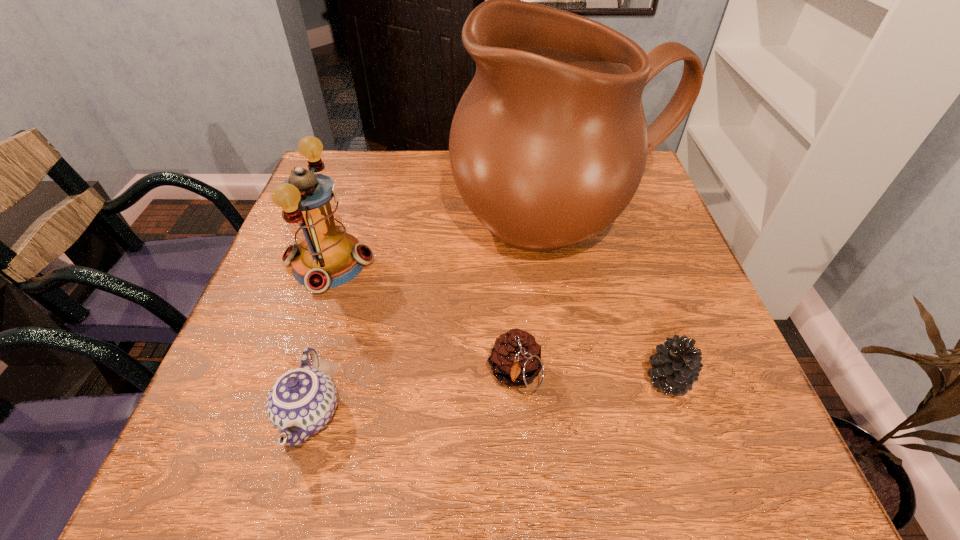
Identify the location of vacant region between the second tallest object and the right pinecone. (499, 321).

Where is `free area in between the fourth shortest object and the right pinecone`? free area in between the fourth shortest object and the right pinecone is located at coordinates (499, 321).

The height and width of the screenshot is (540, 960). I want to click on free spot between the cream pitcher and the right pinecone, so click(x=614, y=301).

Find the location of a particular element. vacant space that is in between the left pinecone and the right pinecone is located at coordinates (591, 377).

I want to click on object that is the fourth nearest to the cream pitcher, so click(302, 401).

Locate which object is the third closest to the lantern. Please provide its 2D coordinates. Your answer should be formatted as a tuple, i.e. [(x, y)], where the tuple contains the x and y coordinates of a point satisfying the conditions above.

[(515, 360)]

Where is `vacant space that satisfies the following two spatial constraints: 1. on the front-facing side of the lantern; 2. on the left side of the right pinecone`? vacant space that satisfies the following two spatial constraints: 1. on the front-facing side of the lantern; 2. on the left side of the right pinecone is located at coordinates (290, 380).

Where is `vacant point that satisfies the following two spatial constraints: 1. on the front-facing side of the right pinecone; 2. on the right side of the fourth shortest object`? Image resolution: width=960 pixels, height=540 pixels. vacant point that satisfies the following two spatial constraints: 1. on the front-facing side of the right pinecone; 2. on the right side of the fourth shortest object is located at coordinates (290, 380).

Locate an element on the screen. The height and width of the screenshot is (540, 960). free spot that satisfies the following two spatial constraints: 1. on the back side of the right pinecone; 2. on the front-facing side of the fourth shortest object is located at coordinates (629, 263).

I want to click on vacant space that satisfies the following two spatial constraints: 1. with a leaf charm attached to the left pinecone; 2. on the right side of the right pinecone, so click(x=516, y=380).